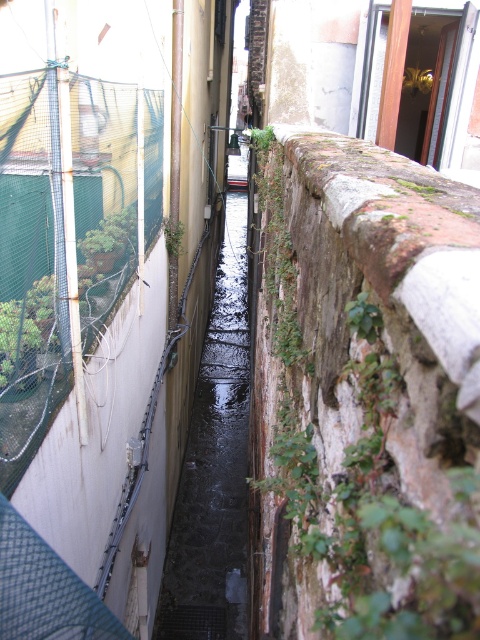
Is green leafy plant at upper center taller than green leafy plant at center?

No.

Can you confirm if green leafy plant at upper center is wider than green leafy plant at center?

Incorrect, green leafy plant at upper center's width does not surpass green leafy plant at center's.

Image resolution: width=480 pixels, height=640 pixels. Describe the element at coordinates (363, 317) in the screenshot. I see `green leafy plant at upper center` at that location.

Locate an element on the screen. green leafy plant at upper center is located at coordinates (363, 317).

Who is shorter, black concrete water at center or green leafy plant at upper center?

With less height is green leafy plant at upper center.

Who is more distant from viewer, (220, 506) or (357, 308)?

Point (220, 506)

This screenshot has height=640, width=480. In order to click on black concrete water at center in this screenshot , I will do `click(214, 467)`.

Which is behind, point (295, 266) or point (168, 241)?

The point (168, 241) is more distant.

Where is `green mossy wall at upper right`? green mossy wall at upper right is located at coordinates (277, 250).